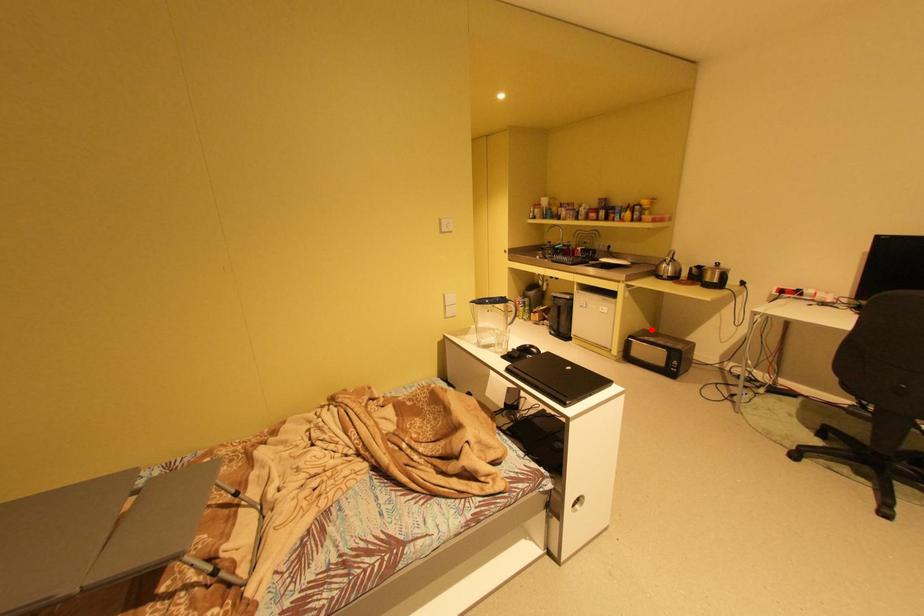
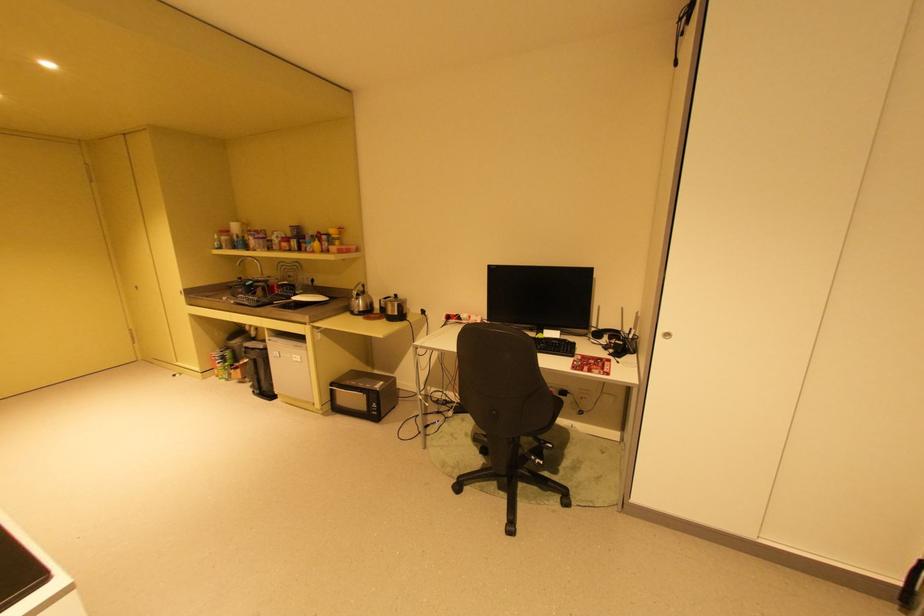
Find the pixel in the second image that matches the highlighted location in the first image.

(359, 371)